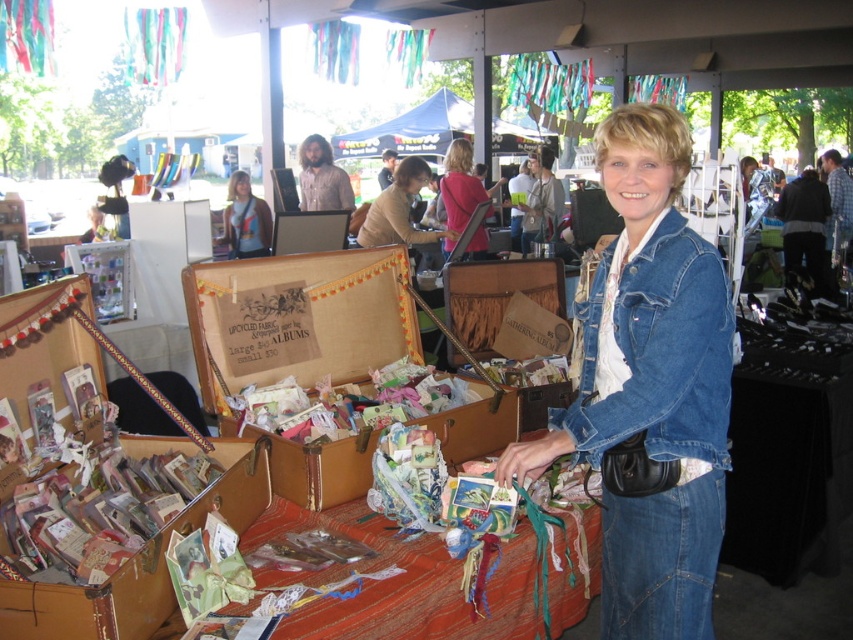
Consider the image. You are a customer at the market looking to purchase a travel accessory. You see the brown leather suitcase at center and the light brown leather jacket at center. Which item would be more suitable for carrying small personal items during a trip?

The brown leather suitcase at center has a smaller size compared to the light brown leather jacket at center, so it would be more suitable for carrying small personal items during a trip.